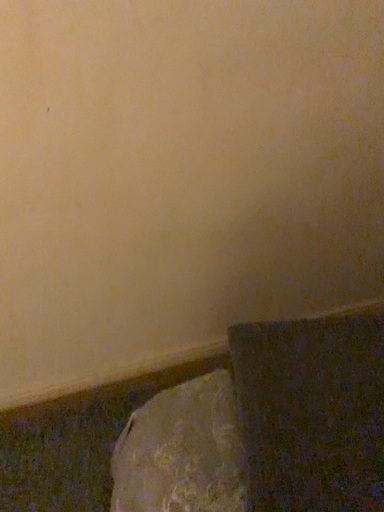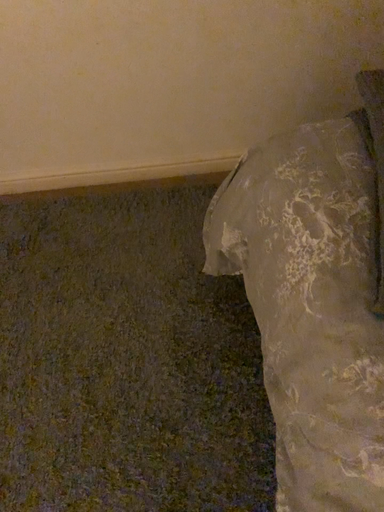
Question: How did the camera likely rotate when shooting the video?

Choices:
 (A) rotated downward
 (B) rotated upward

Answer: (A)